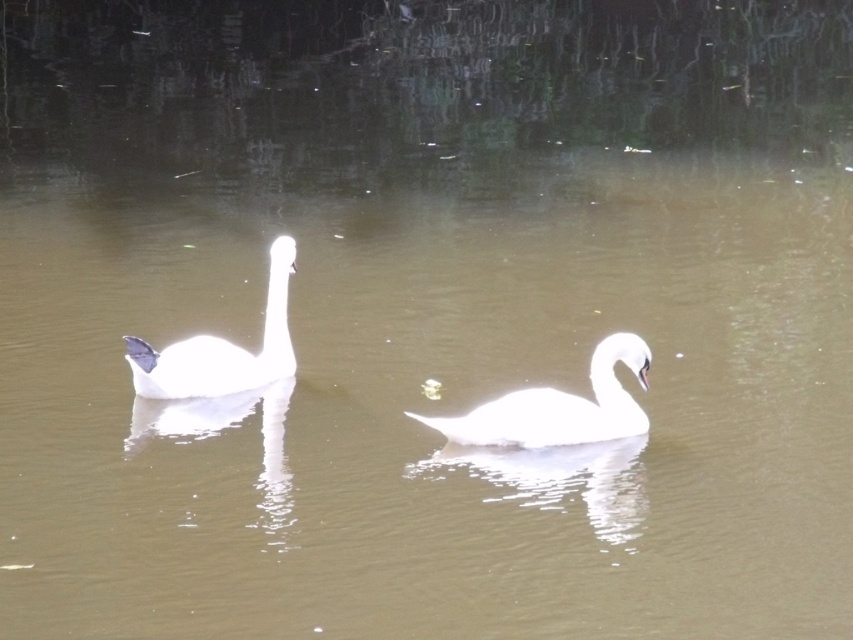
Does point (639, 413) come in front of point (177, 349)?

No, it is not.

Between white glossy swan at center and white glossy swan at left, which one has less height?

Standing shorter between the two is white glossy swan at center.

Locate an element on the screen. The image size is (853, 640). white glossy swan at center is located at coordinates (560, 406).

This screenshot has height=640, width=853. Identify the location of white glossy swan at center. (560, 406).